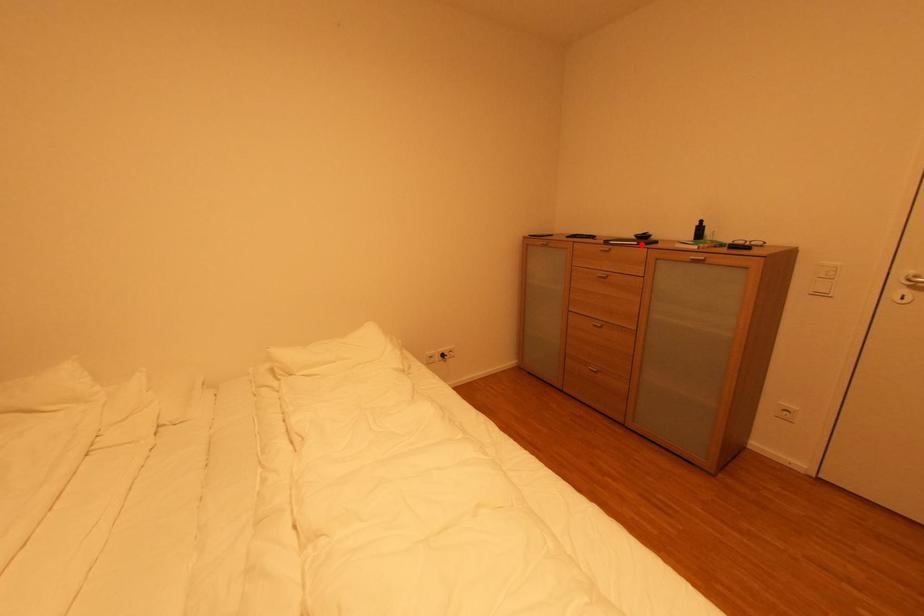
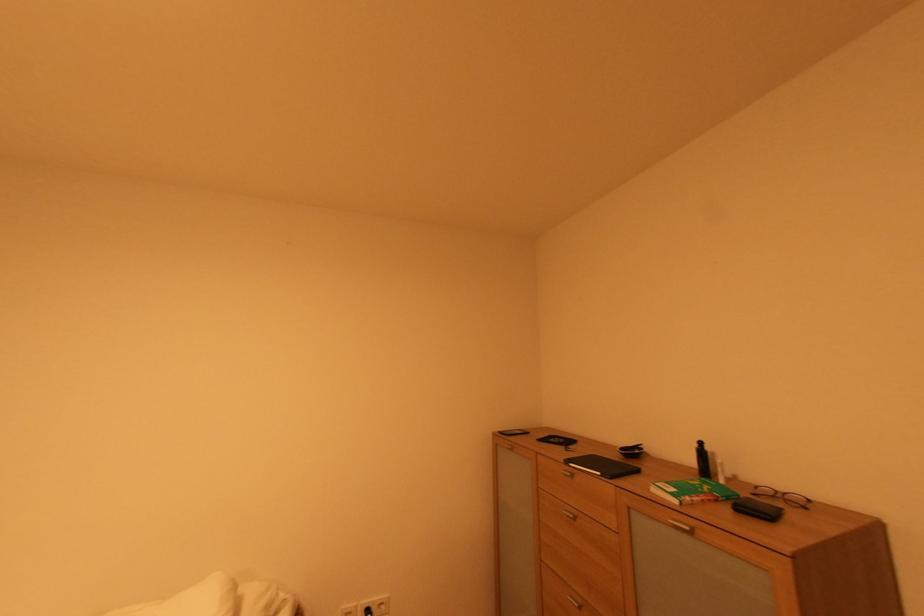
Find the pixel in the second image that matches the highlighted location in the first image.

(604, 475)